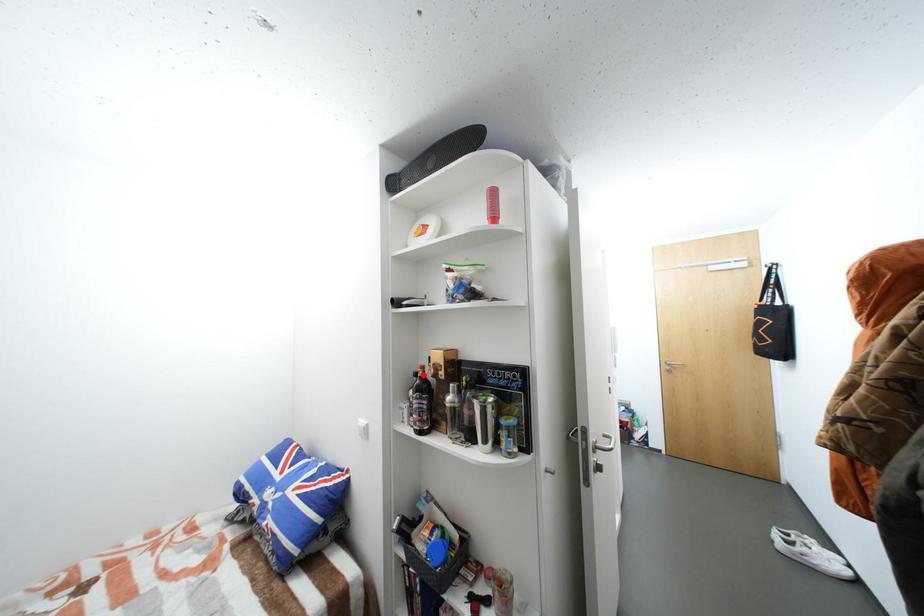
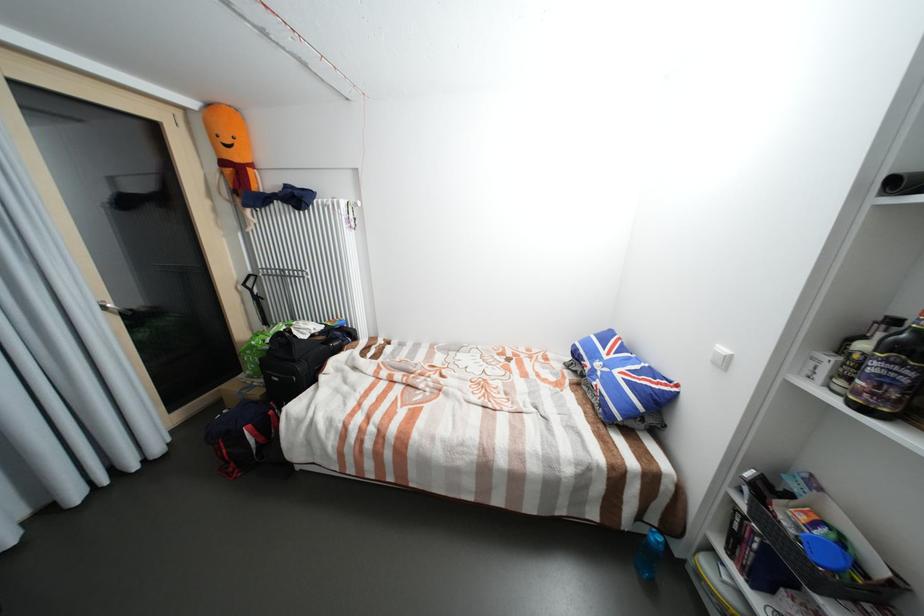
In the second image, find the point that corresponds to the highlighted location in the first image.

(901, 322)